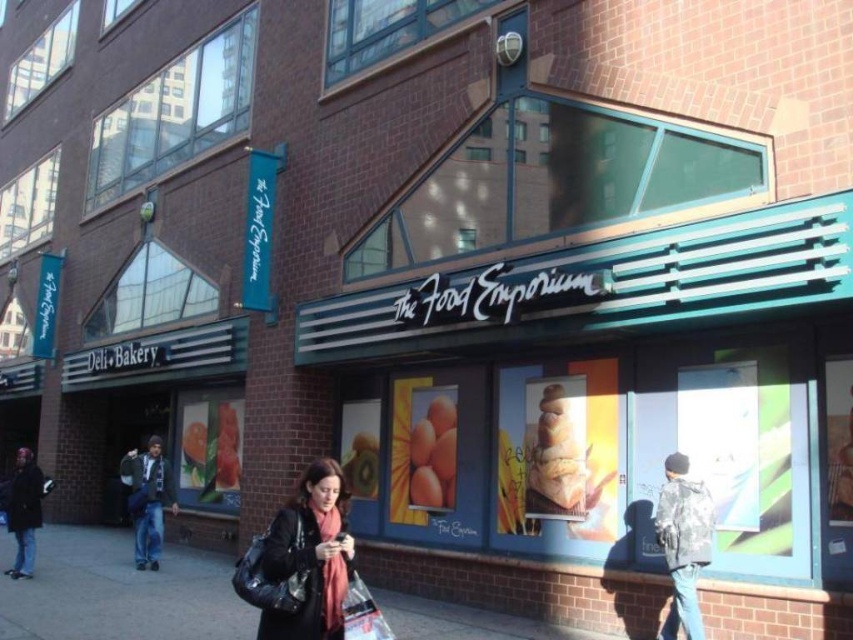
Does leather jacket at center have a greater width compared to smooth green cucumber at center?

In fact, leather jacket at center might be narrower than smooth green cucumber at center.

Which is in front, point (300, 612) or point (241, 452)?

Point (300, 612) is in front.

This screenshot has height=640, width=853. I want to click on leather jacket at center, so click(310, 556).

In the scene shown: Does dark gray jacket at lower left appear over plastic shopping bag at lower center?

No, dark gray jacket at lower left is not above plastic shopping bag at lower center.

Which is in front, point (15, 506) or point (357, 637)?

Point (357, 637) is more forward.

This screenshot has height=640, width=853. Find the location of `dark gray jacket at lower left`. dark gray jacket at lower left is located at coordinates (22, 512).

Does smooth yellow eggs at center have a greater height compared to plastic shopping bag at lower center?

Indeed, smooth yellow eggs at center has a greater height compared to plastic shopping bag at lower center.

Locate an element on the screen. The width and height of the screenshot is (853, 640). smooth yellow eggs at center is located at coordinates (433, 452).